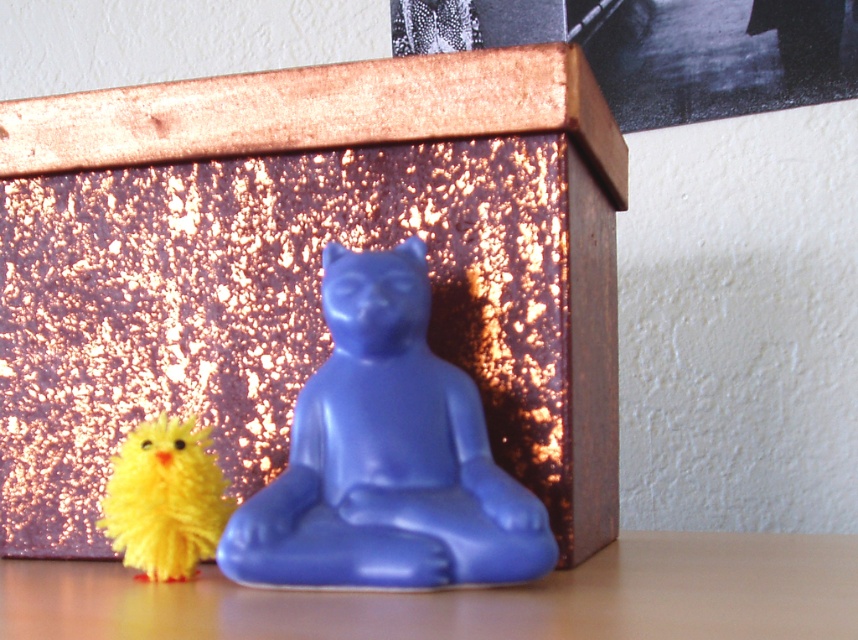
Question: Can you confirm if metallic gold box at center is positioned above matte wood table at lower center?

Choices:
 (A) no
 (B) yes

Answer: (B)

Question: Is metallic gold box at center wider than matte wood table at lower center?

Choices:
 (A) yes
 (B) no

Answer: (B)

Question: Which point is closer to the camera?

Choices:
 (A) (565, 256)
 (B) (127, 522)

Answer: (B)

Question: Which point is farther from the camera taking this photo?

Choices:
 (A) (203, 472)
 (B) (502, 564)
 (C) (292, 324)

Answer: (C)

Question: Considering the real-world distances, which object is farthest from the yellow fuzzy chick at lower left?

Choices:
 (A) metallic gold box at center
 (B) matte wood table at lower center
 (C) matte blue statue at center

Answer: (B)

Question: From the image, what is the correct spatial relationship of metallic gold box at center in relation to matte blue statue at center?

Choices:
 (A) above
 (B) below

Answer: (A)